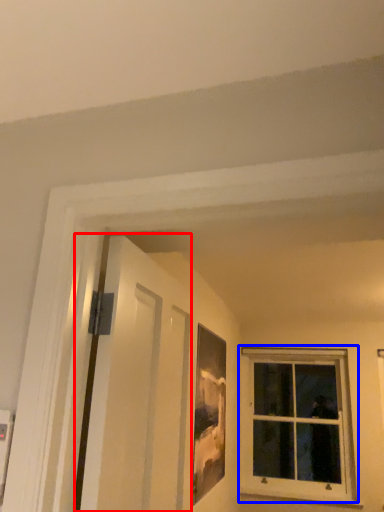
Question: Which of the following is the closest to the observer, screen door (highlighted by a red box) or window (highlighted by a blue box)?

Choices:
 (A) screen door
 (B) window

Answer: (A)